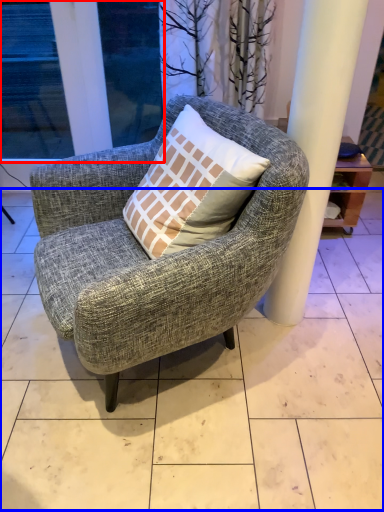
Question: Which of the following is the closest to the observer, window (highlighted by a red box) or tile (highlighted by a blue box)?

Choices:
 (A) window
 (B) tile

Answer: (B)